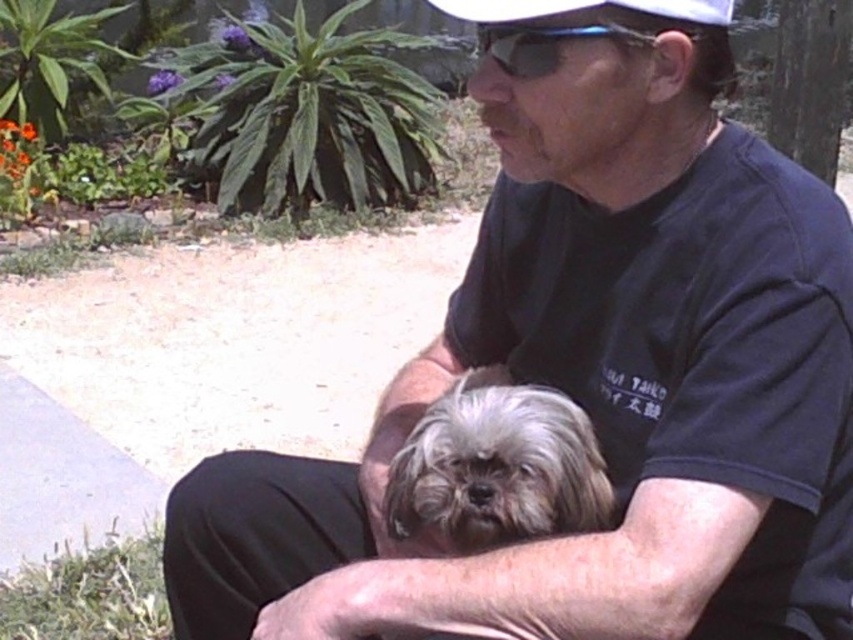
Is fluffy gray fur at center above white matte baseball cap at upper center?

No.

Is fluffy gray fur at center taller than white matte baseball cap at upper center?

Correct, fluffy gray fur at center is much taller as white matte baseball cap at upper center.

Which is in front, point (538, 476) or point (503, 4)?

Point (503, 4)

This screenshot has width=853, height=640. What are the coordinates of `fluffy gray fur at center` in the screenshot? It's located at (496, 468).